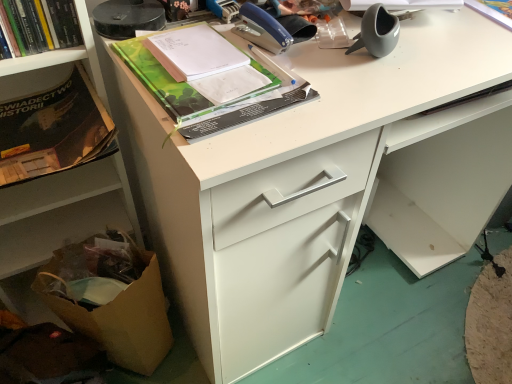
Find the location of `vacant area that is situated to the right of matte gray vase at upper right, which is the 2th office supplies in left-to-right order`. vacant area that is situated to the right of matte gray vase at upper right, which is the 2th office supplies in left-to-right order is located at coordinates (452, 49).